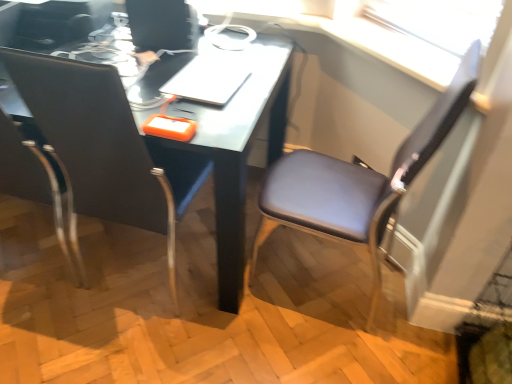
Question: Is matte black chair at right, the 1th chair when ordered from right to left, positioned behind black leather chair at left, placed as the 1th chair when sorted from left to right?

Choices:
 (A) no
 (B) yes

Answer: (B)

Question: Would you consider matte black chair at right, the second chair in the left-to-right sequence, to be distant from black leather chair at left, the second chair viewed from the right?

Choices:
 (A) yes
 (B) no

Answer: (B)

Question: Does matte black chair at right, the 1th chair when ordered from right to left, have a lesser height compared to black leather chair at left, the second chair viewed from the right?

Choices:
 (A) yes
 (B) no

Answer: (B)

Question: Is matte black chair at right, the second chair in the left-to-right sequence, to the right of black leather chair at left, the second chair viewed from the right, from the viewer's perspective?

Choices:
 (A) no
 (B) yes

Answer: (B)

Question: Considering the relative sizes of matte black chair at right, the 1th chair when ordered from right to left, and black leather chair at left, the second chair viewed from the right, in the image provided, is matte black chair at right, the 1th chair when ordered from right to left, taller than black leather chair at left, the second chair viewed from the right,?

Choices:
 (A) no
 (B) yes

Answer: (B)

Question: Considering the relative sizes of matte black chair at right, the 1th chair when ordered from right to left, and black leather chair at left, placed as the 1th chair when sorted from left to right, in the image provided, is matte black chair at right, the 1th chair when ordered from right to left, wider than black leather chair at left, placed as the 1th chair when sorted from left to right,?

Choices:
 (A) yes
 (B) no

Answer: (B)

Question: Is black leather chair at left, placed as the 1th chair when sorted from left to right, behind matte black chair at right, the second chair in the left-to-right sequence?

Choices:
 (A) no
 (B) yes

Answer: (A)

Question: From a real-world perspective, is black leather chair at left, the second chair viewed from the right, below matte black chair at right, the 1th chair when ordered from right to left?

Choices:
 (A) yes
 (B) no

Answer: (B)

Question: Does black leather chair at left, placed as the 1th chair when sorted from left to right, have a lesser height compared to matte black chair at right, the second chair in the left-to-right sequence?

Choices:
 (A) yes
 (B) no

Answer: (A)

Question: Is black leather chair at left, placed as the 1th chair when sorted from left to right, with matte black chair at right, the 1th chair when ordered from right to left?

Choices:
 (A) no
 (B) yes

Answer: (A)

Question: Is black leather chair at left, placed as the 1th chair when sorted from left to right, to the right of matte black chair at right, the 1th chair when ordered from right to left, from the viewer's perspective?

Choices:
 (A) yes
 (B) no

Answer: (B)

Question: Can you confirm if black leather chair at left, placed as the 1th chair when sorted from left to right, is smaller than matte black chair at right, the 1th chair when ordered from right to left?

Choices:
 (A) no
 (B) yes

Answer: (A)

Question: Looking at the image, does black leather chair at left, placed as the 1th chair when sorted from left to right, seem bigger or smaller compared to matte black chair at right, the second chair in the left-to-right sequence?

Choices:
 (A) big
 (B) small

Answer: (A)